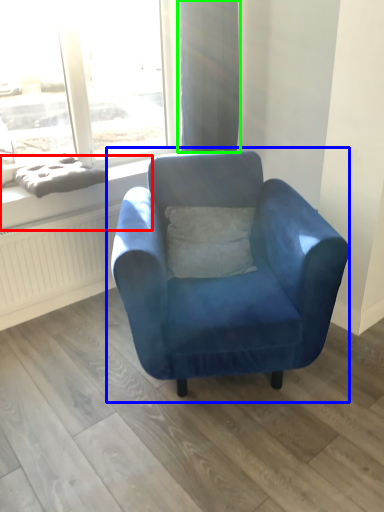
Question: Estimate the real-world distances between objects in this image. Which object is farther from window sill (highlighted by a red box), chair (highlighted by a blue box) or curtain (highlighted by a green box)?

Choices:
 (A) chair
 (B) curtain

Answer: (A)